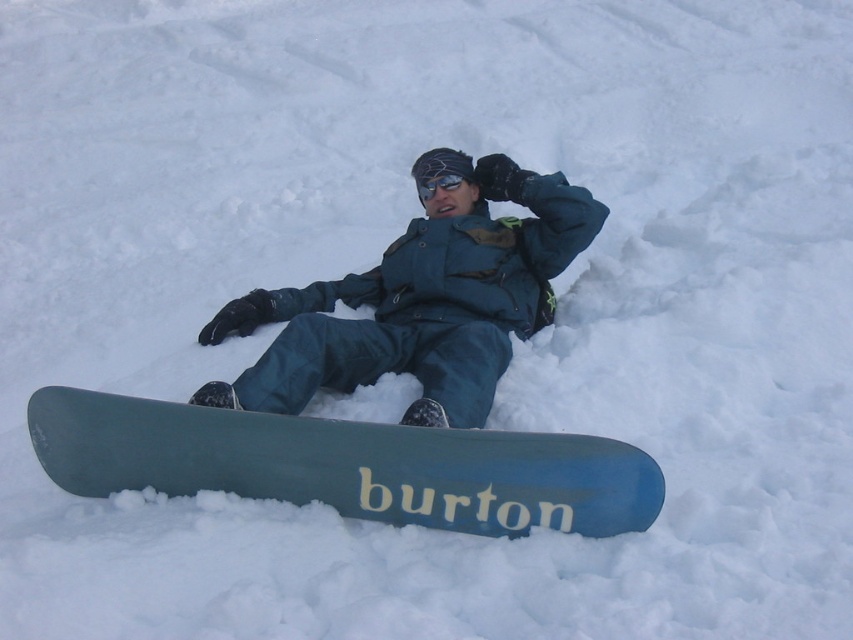
You are a photographer trying to capture the snowboarder in the image. You want to focus on the point closest to the camera between the two points labeled as point (318, 432) and point (473, 256). Which point should you choose?

Point (318, 432) is closer to the camera than point (473, 256), so you should focus on point (318, 432).

You are a photographer trying to capture the perfect shot of the matte blue snowboard at center. The camera is set to focus at point coordinates 0.594, 0.442. Will the snowboard be in focus?

The matte blue snowboard at center is positioned exactly at point coordinates (376, 380), so the snowboard will be in focus.